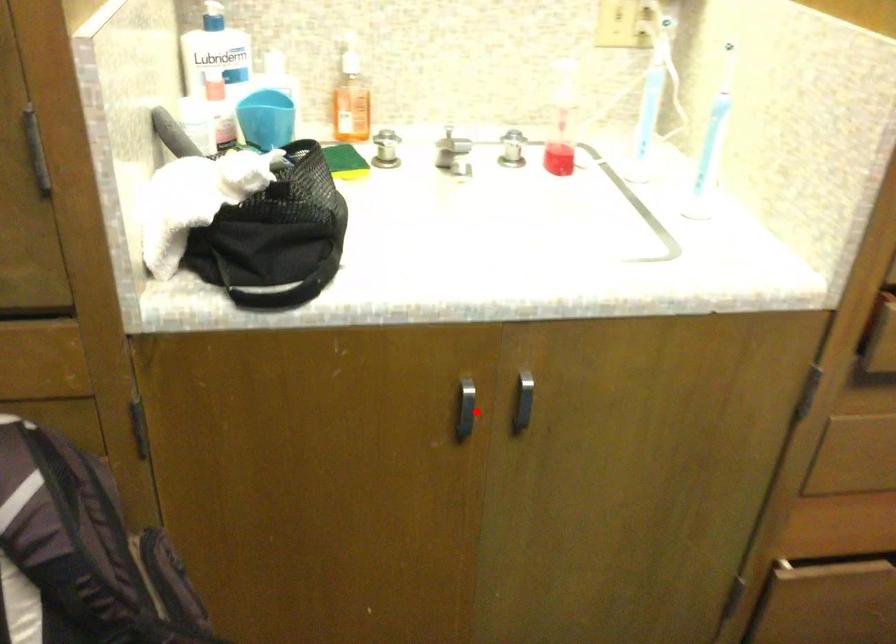
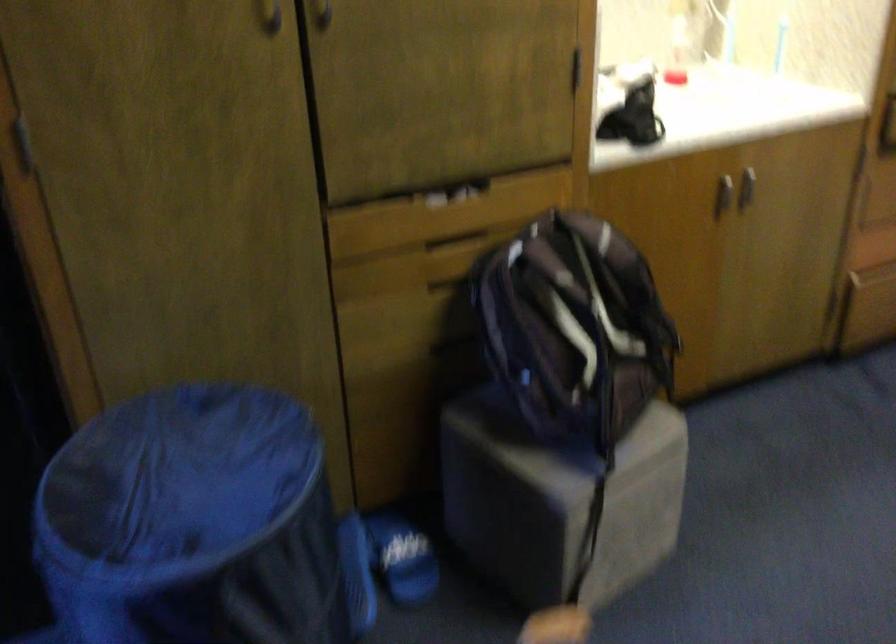
Locate, in the second image, the point that corresponds to the highlighted location in the first image.

(722, 194)